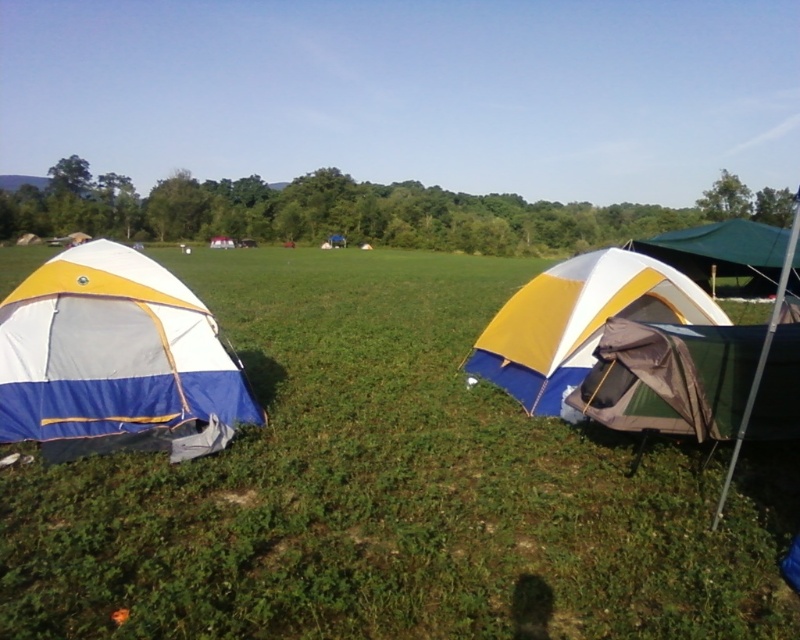
You are planning to set up a picnic blanket in the camping scene. The picnic blanket is 1.5 meters wide. There is a green grassy area at center marked by point (392, 490). Can you place the picnic blanket there without it overlapping any tents?

The green grassy area at center marked by point (392, 490) is free of tents, so yes, you can place the picnic blanket there without overlapping any tents.